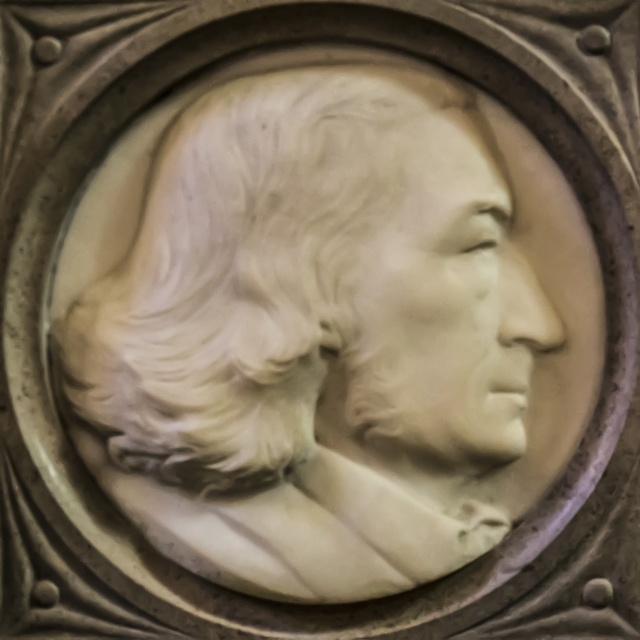
You are an art conservator examining the relief sculpture. The sculpture is displayed in a gallery with a coordinate system where the bottom left corner is the origin. You need to locate the white marble bust at center. What are its coordinates?

The white marble bust at center is located at coordinates point (326, 330).

In the scene shown: You are an art conservator examining the relief sculpture. You notice that the white marble bust at center and the white marble face at center are positioned in a specific way. Which object is located lower in the sculpture?

The white marble bust at center is located lower than the white marble face at center.